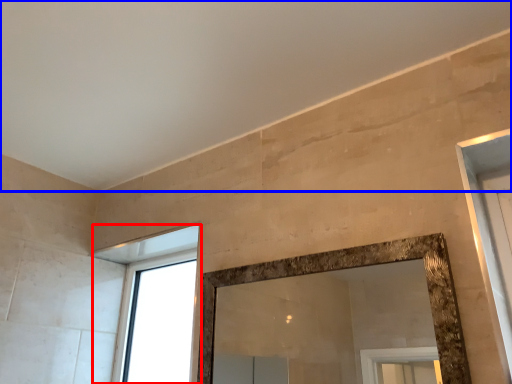
Question: Which object is closer to the camera taking this photo, window (highlighted by a red box) or backdrop (highlighted by a blue box)?

Choices:
 (A) window
 (B) backdrop

Answer: (B)